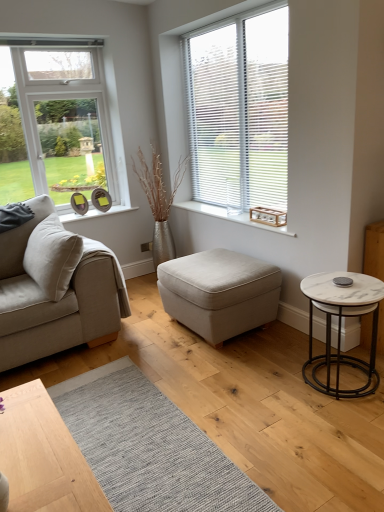
Where is `free point below white marble side table at right (from a real-world perspective)`? Image resolution: width=384 pixels, height=512 pixels. free point below white marble side table at right (from a real-world perspective) is located at coordinates (334, 379).